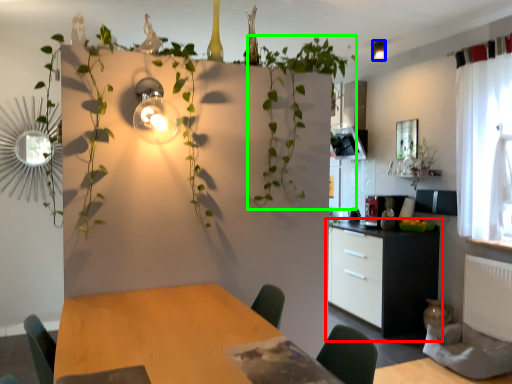
Question: Which object is the farthest from cabinetry (highlighted by a red box)? Choose among these: light fixture (highlighted by a blue box) or vegetation (highlighted by a green box).

Choices:
 (A) light fixture
 (B) vegetation

Answer: (A)